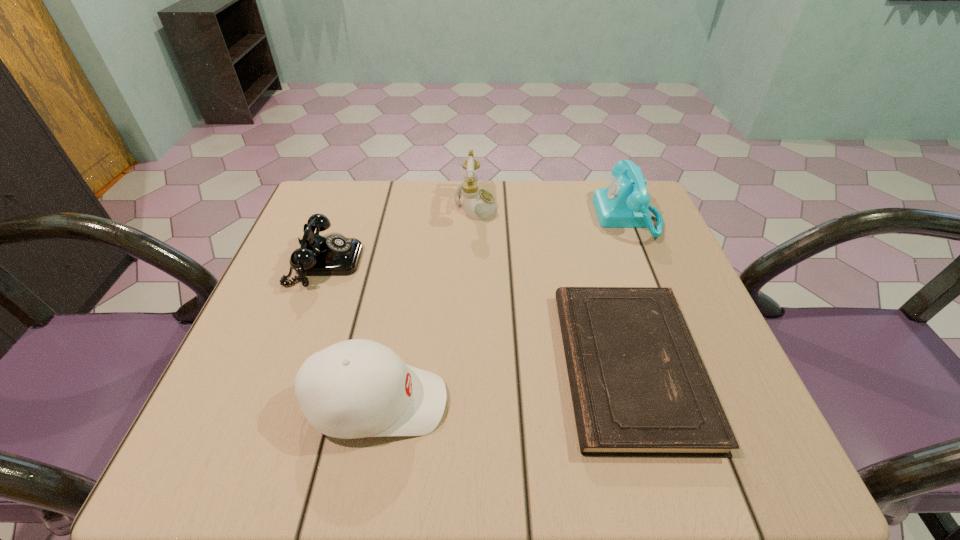
Where is `the second telephone from right to left`? Image resolution: width=960 pixels, height=540 pixels. the second telephone from right to left is located at coordinates (479, 204).

Image resolution: width=960 pixels, height=540 pixels. Identify the location of the rightmost telephone. (625, 203).

This screenshot has height=540, width=960. In order to click on baseball cap in this screenshot , I will do `click(358, 388)`.

Identify the location of the second shortest object. The image size is (960, 540). (335, 255).

This screenshot has width=960, height=540. In order to click on the leftmost telephone in this screenshot , I will do pos(335,255).

At what (x,y) coordinates should I click in order to perform the action: click on paperback book. Please return your answer as a coordinate pair (x, y). Looking at the image, I should click on (639, 388).

You are a GUI agent. You are given a task and a screenshot of the screen. Output one action in this format:
    pyautogui.click(x=<x>, y=<y>)
    Task: Click on the vacant space positioned 0.230m on the dial of the second telephone from left to right
    This screenshot has height=540, width=960.
    Given the screenshot: What is the action you would take?
    click(x=582, y=205)

The width and height of the screenshot is (960, 540). I want to click on vacant point located on the dial of the rightmost telephone, so click(497, 217).

Where is `vacant region located 0.200m on the dial of the rightmost telephone`? The width and height of the screenshot is (960, 540). vacant region located 0.200m on the dial of the rightmost telephone is located at coordinates (520, 217).

Find the location of `vacant space situated on the dial of the rightmost telephone`. vacant space situated on the dial of the rightmost telephone is located at coordinates (486, 217).